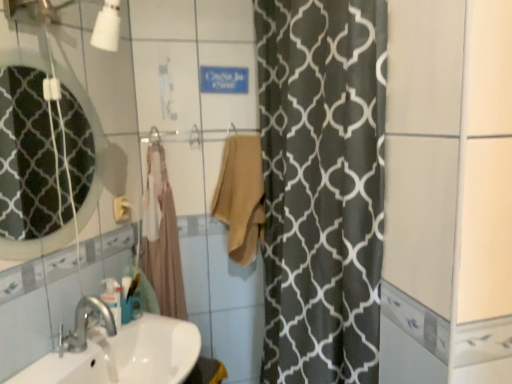
In order to click on translucent plastic soap dispenser at lower left in this screenshot , I will do `click(113, 299)`.

Based on the photo, what is the approximate height of matte glass mirror at upper left?

matte glass mirror at upper left is 24.27 inches in height.

The height and width of the screenshot is (384, 512). What do you see at coordinates (26, 157) in the screenshot?
I see `matte glass mirror at upper left` at bounding box center [26, 157].

You are a GUI agent. You are given a task and a screenshot of the screen. Output one action in this format:
    pyautogui.click(x=<x>, y=<y>)
    Task: Click on the beige cotton bath towel at center, acting as the first bath towel starting from the left
    This screenshot has height=384, width=512.
    Given the screenshot: What is the action you would take?
    pyautogui.click(x=163, y=239)

Do you think matte glass mirror at upper left is within beige cotton bath towel at center, marked as the 2th bath towel in a right-to-left arrangement, or outside of it?

matte glass mirror at upper left is not enclosed by beige cotton bath towel at center, marked as the 2th bath towel in a right-to-left arrangement.

Between matte glass mirror at upper left and beige cotton bath towel at center, acting as the first bath towel starting from the left, which one has less height?

Standing shorter between the two is matte glass mirror at upper left.

How different are the orientations of matte glass mirror at upper left and beige cotton bath towel at center, acting as the first bath towel starting from the left, in degrees?

The facing directions of matte glass mirror at upper left and beige cotton bath towel at center, acting as the first bath towel starting from the left, are 53 degrees apart.

Which object is more forward, matte glass mirror at upper left or beige cotton bath towel at center, acting as the first bath towel starting from the left?

matte glass mirror at upper left is in front.

How many degrees apart are the facing directions of beige cotton bath towel at center, marked as the 2th bath towel in a right-to-left arrangement, and translucent plastic soap dispenser at lower left?

beige cotton bath towel at center, marked as the 2th bath towel in a right-to-left arrangement, and translucent plastic soap dispenser at lower left are facing 50.8 degrees away from each other.

Does beige cotton bath towel at center, marked as the 2th bath towel in a right-to-left arrangement, contain translucent plastic soap dispenser at lower left?

No, translucent plastic soap dispenser at lower left is not a part of beige cotton bath towel at center, marked as the 2th bath towel in a right-to-left arrangement.

Where is `the 1st bath towel behind the translucent plastic soap dispenser at lower left`? the 1st bath towel behind the translucent plastic soap dispenser at lower left is located at coordinates (163, 239).

Considering the sizes of beige cotton bath towel at center, marked as the 2th bath towel in a right-to-left arrangement, and translucent plastic soap dispenser at lower left in the image, is beige cotton bath towel at center, marked as the 2th bath towel in a right-to-left arrangement, taller or shorter than translucent plastic soap dispenser at lower left?

beige cotton bath towel at center, marked as the 2th bath towel in a right-to-left arrangement, is taller than translucent plastic soap dispenser at lower left.

From the image's perspective, which one is positioned higher, translucent plastic soap dispenser at lower left or white glossy sink at lower left?

translucent plastic soap dispenser at lower left.

Between translucent plastic soap dispenser at lower left and white glossy sink at lower left, which one has larger width?

white glossy sink at lower left is wider.

What's the angular difference between translucent plastic soap dispenser at lower left and white glossy sink at lower left's facing directions?

There is a 4.89-degree angle between the facing directions of translucent plastic soap dispenser at lower left and white glossy sink at lower left.

Is translucent plastic soap dispenser at lower left facing towards white glossy sink at lower left?

No.

Between beige cotton bath towel at center, marked as the 2th bath towel in a right-to-left arrangement, and beige cotton towel at center, which is counted as the 1th bath towel, starting from the right, which one has larger width?

beige cotton towel at center, which is counted as the 1th bath towel, starting from the right, is wider.

Considering the relative sizes of beige cotton bath towel at center, marked as the 2th bath towel in a right-to-left arrangement, and beige cotton towel at center, which is counted as the 1th bath towel, starting from the right, in the image provided, is beige cotton bath towel at center, marked as the 2th bath towel in a right-to-left arrangement, taller than beige cotton towel at center, which is counted as the 1th bath towel, starting from the right,?

Indeed, beige cotton bath towel at center, marked as the 2th bath towel in a right-to-left arrangement, has a greater height compared to beige cotton towel at center, which is counted as the 1th bath towel, starting from the right.

How far apart are beige cotton bath towel at center, acting as the first bath towel starting from the left, and beige cotton towel at center, the second bath towel in the left-to-right sequence?

beige cotton bath towel at center, acting as the first bath towel starting from the left, and beige cotton towel at center, the second bath towel in the left-to-right sequence, are 11.04 inches apart.

Is point (154, 288) positioned after point (247, 198)?

That is False.

Between matte glass mirror at upper left and beige cotton towel at center, the second bath towel in the left-to-right sequence, which one appears on the left side from the viewer's perspective?

Positioned to the left is matte glass mirror at upper left.

Based on the photo, does matte glass mirror at upper left have a greater height compared to beige cotton towel at center, which is counted as the 1th bath towel, starting from the right?

Indeed, matte glass mirror at upper left has a greater height compared to beige cotton towel at center, which is counted as the 1th bath towel, starting from the right.

Is point (23, 103) behind point (260, 150)?

That is True.

From a real-world perspective, is matte glass mirror at upper left over beige cotton towel at center, which is counted as the 1th bath towel, starting from the right?

Yes, from a real-world perspective, matte glass mirror at upper left is on top of beige cotton towel at center, which is counted as the 1th bath towel, starting from the right.

Looking at this image, from the image's perspective, is beige cotton bath towel at center, acting as the first bath towel starting from the left, under white glossy sink at lower left?

Incorrect, from the image's perspective, beige cotton bath towel at center, acting as the first bath towel starting from the left, is higher than white glossy sink at lower left.

Is beige cotton bath towel at center, marked as the 2th bath towel in a right-to-left arrangement, turned away from white glossy sink at lower left?

No, beige cotton bath towel at center, marked as the 2th bath towel in a right-to-left arrangement,'s orientation is not away from white glossy sink at lower left.

Which object is positioned more to the right, beige cotton bath towel at center, acting as the first bath towel starting from the left, or white glossy sink at lower left?

beige cotton bath towel at center, acting as the first bath towel starting from the left.

Consider the image. Is matte glass mirror at upper left not inside translucent plastic soap dispenser at lower left?

Indeed, matte glass mirror at upper left is completely outside translucent plastic soap dispenser at lower left.

Is translucent plastic soap dispenser at lower left at the back of matte glass mirror at upper left?

No, translucent plastic soap dispenser at lower left is not at the back of matte glass mirror at upper left.

Is point (38, 97) positioned behind point (119, 284)?

Yes.

Considering the relative sizes of matte glass mirror at upper left and translucent plastic soap dispenser at lower left in the image provided, is matte glass mirror at upper left wider than translucent plastic soap dispenser at lower left?

In fact, matte glass mirror at upper left might be narrower than translucent plastic soap dispenser at lower left.

You are a GUI agent. You are given a task and a screenshot of the screen. Output one action in this format:
    pyautogui.click(x=<x>, y=<y>)
    Task: Click on the mirror in front of the beige cotton bath towel at center, marked as the 2th bath towel in a right-to-left arrangement
    
    Given the screenshot: What is the action you would take?
    pyautogui.click(x=26, y=157)

From the translucent plastic soap dispenser at lower left, count 1st bath towels backward and point to it. Please provide its 2D coordinates.

[(163, 239)]

Based on their spatial positions, is beige cotton towel at center, which is counted as the 1th bath towel, starting from the right, or translucent plastic soap dispenser at lower left closer to matte glass mirror at upper left?

Among the two, translucent plastic soap dispenser at lower left is located nearer to matte glass mirror at upper left.

When comparing their distances from beige cotton bath towel at center, marked as the 2th bath towel in a right-to-left arrangement, does white glossy sink at lower left or beige cotton towel at center, which is counted as the 1th bath towel, starting from the right, seem further?

white glossy sink at lower left.

Looking at the image, which one is located further to white glossy sink at lower left, beige cotton towel at center, the second bath towel in the left-to-right sequence, or beige cotton bath towel at center, acting as the first bath towel starting from the left?

beige cotton towel at center, the second bath towel in the left-to-right sequence.

Considering their positions, is beige cotton bath towel at center, acting as the first bath towel starting from the left, positioned further to matte glass mirror at upper left than beige cotton towel at center, which is counted as the 1th bath towel, starting from the right?

Based on the image, beige cotton towel at center, which is counted as the 1th bath towel, starting from the right, appears to be further to matte glass mirror at upper left.

When comparing their distances from beige cotton bath towel at center, marked as the 2th bath towel in a right-to-left arrangement, does translucent plastic soap dispenser at lower left or beige cotton towel at center, the second bath towel in the left-to-right sequence, seem closer?

Based on the image, beige cotton towel at center, the second bath towel in the left-to-right sequence, appears to be nearer to beige cotton bath towel at center, marked as the 2th bath towel in a right-to-left arrangement.

When comparing their distances from matte glass mirror at upper left, does translucent plastic soap dispenser at lower left or white glossy sink at lower left seem closer?

Among the two, translucent plastic soap dispenser at lower left is located nearer to matte glass mirror at upper left.

From the image, which object appears to be nearer to matte glass mirror at upper left, white glossy sink at lower left or beige cotton towel at center, the second bath towel in the left-to-right sequence?

beige cotton towel at center, the second bath towel in the left-to-right sequence, lies closer to matte glass mirror at upper left than the other object.

Looking at the image, which one is located closer to beige cotton towel at center, the second bath towel in the left-to-right sequence, white glossy sink at lower left or translucent plastic soap dispenser at lower left?

Based on the image, white glossy sink at lower left appears to be nearer to beige cotton towel at center, the second bath towel in the left-to-right sequence.

Identify the location of toiletry between beige cotton towel at center, the second bath towel in the left-to-right sequence, and white glossy sink at lower left vertically. (113, 299).

You are a GUI agent. You are given a task and a screenshot of the screen. Output one action in this format:
    pyautogui.click(x=<x>, y=<y>)
    Task: Click on the bath towel located between matte glass mirror at upper left and beige cotton towel at center, the second bath towel in the left-to-right sequence, in the depth direction
    The height and width of the screenshot is (384, 512).
    Given the screenshot: What is the action you would take?
    pyautogui.click(x=163, y=239)

Locate an element on the screen. Image resolution: width=512 pixels, height=384 pixels. toiletry between white glossy sink at lower left and beige cotton bath towel at center, marked as the 2th bath towel in a right-to-left arrangement, in the front-back direction is located at coordinates 113,299.

Image resolution: width=512 pixels, height=384 pixels. I want to click on toiletry between matte glass mirror at upper left and white glossy sink at lower left vertically, so click(x=113, y=299).